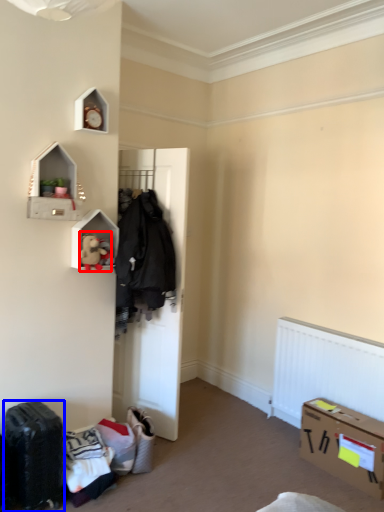
Question: Which point is further to the camera, toy (highlighted by a red box) or luggage (highlighted by a blue box)?

Choices:
 (A) toy
 (B) luggage

Answer: (A)